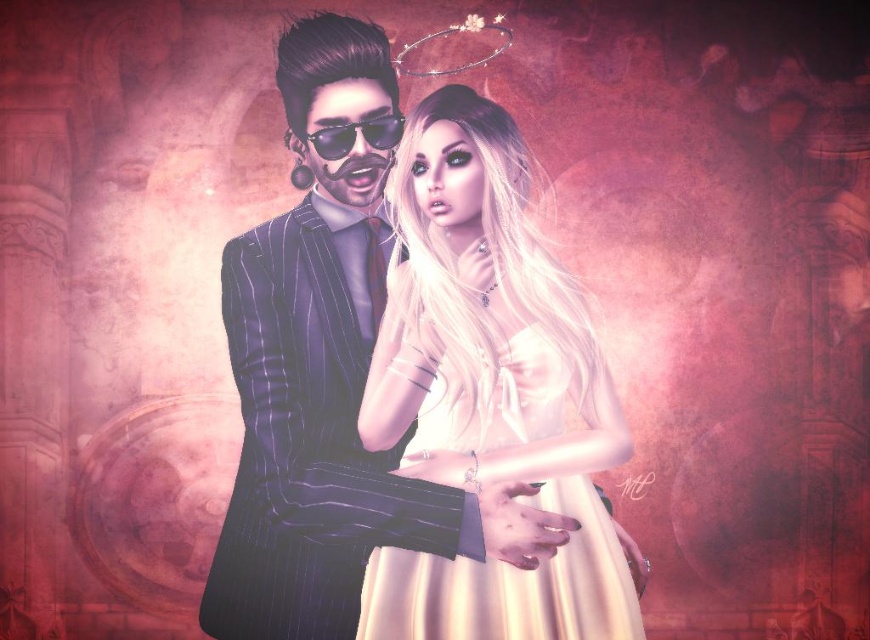
You are standing in front of the image and want to know how far the point at coordinates (256, 541) is from your current position. Can you determine the distance?

The point at coordinates (256, 541) is 2.02 meters away from the camera, so it is 2.02 meters away from your current position.

You are a photographer standing 1.5 meters away from the shiny black suit at center. Can you capture the entire suit in your camera frame without moving closer or farther away?

The shiny black suit at center is 1.65 meters away from the camera. Since you are standing 1.5 meters away from it, you are closer than the required distance. To capture the entire suit without moving, you would need to adjust your camera angle or use a wider lens.

You are standing 6 feet away from the image. Is the point at coordinates point (313, 525) closer to you than your current position?

The distance of point (313, 525) from viewer is 5.84 feet, so yes, the point is closer to you than your current position of 6 feet away.